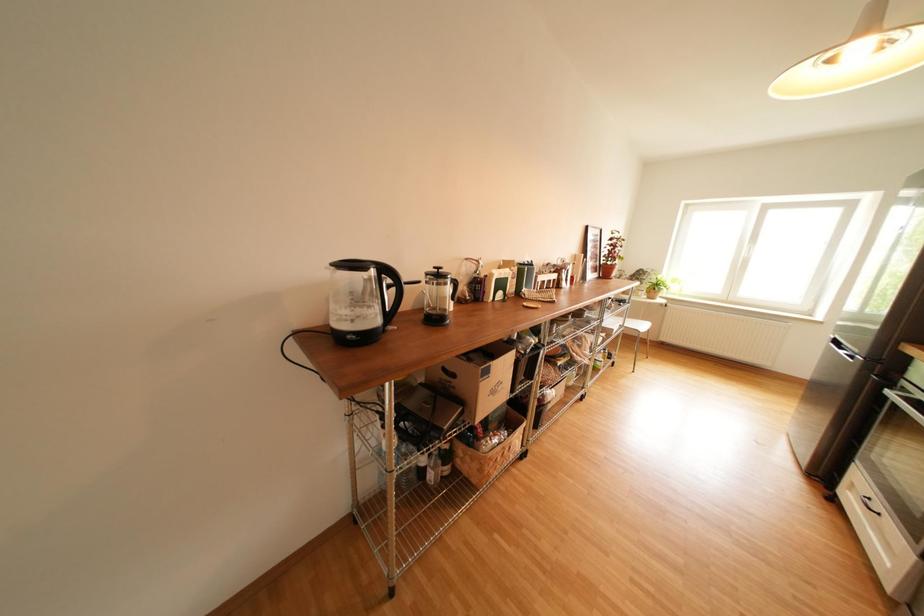
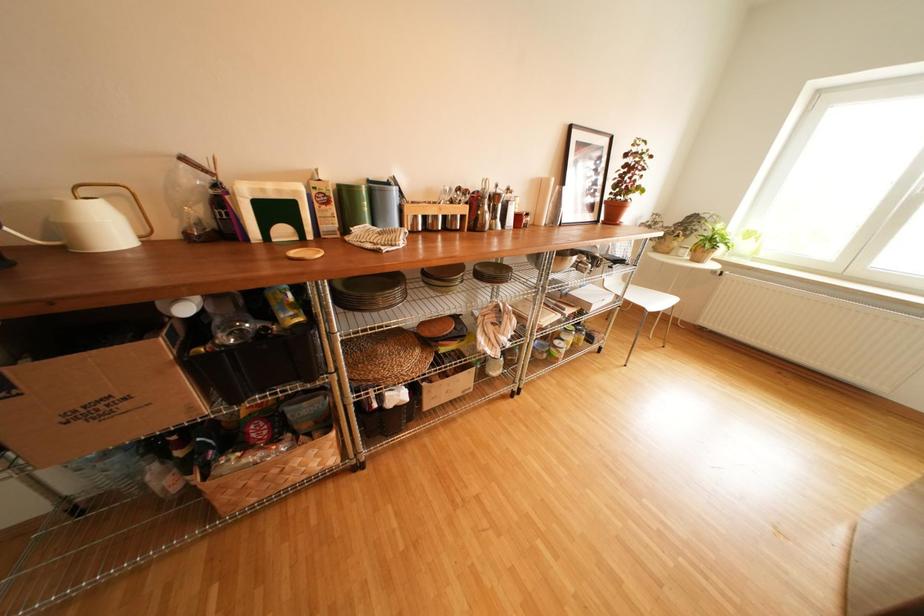
The images are taken continuously from a first-person perspective. In which direction are you moving?

The cameraman walked toward right, forward.